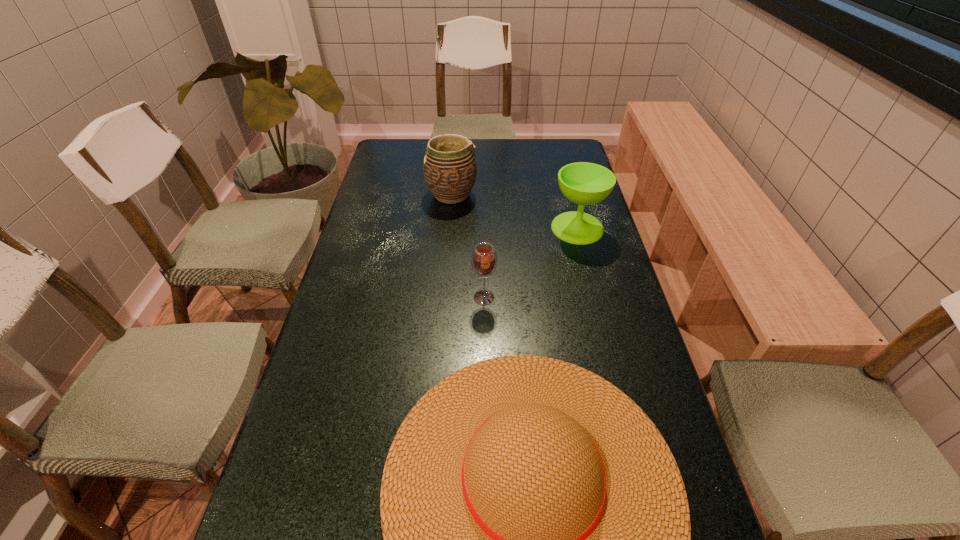
You are a GUI agent. You are given a task and a screenshot of the screen. Output one action in this format:
    pyautogui.click(x=<x>, y=<y>)
    Task: Click on the farthest object
    
    Given the screenshot: What is the action you would take?
    pyautogui.click(x=449, y=167)

The width and height of the screenshot is (960, 540). Find the location of `the farther wineglass`. the farther wineglass is located at coordinates (583, 183).

Find the location of `the right wineglass`. the right wineglass is located at coordinates (x=583, y=183).

Image resolution: width=960 pixels, height=540 pixels. What are the coordinates of `the left wineglass` in the screenshot? It's located at (484, 259).

Where is `the nearer wineglass`? the nearer wineglass is located at coordinates (484, 259).

Locate an element on the screen. vacant region located on the right of the farthest object is located at coordinates click(x=492, y=195).

Locate an element on the screen. This screenshot has width=960, height=540. vacant area located on the left of the farther wineglass is located at coordinates (451, 228).

Identify the location of vacant space located on the front of the nearer wineglass. The height and width of the screenshot is (540, 960). (485, 398).

Identify the location of object that is at the right edge. The width and height of the screenshot is (960, 540). (583, 183).

In order to click on free spot at the far edge of the desktop in this screenshot , I will do `click(491, 161)`.